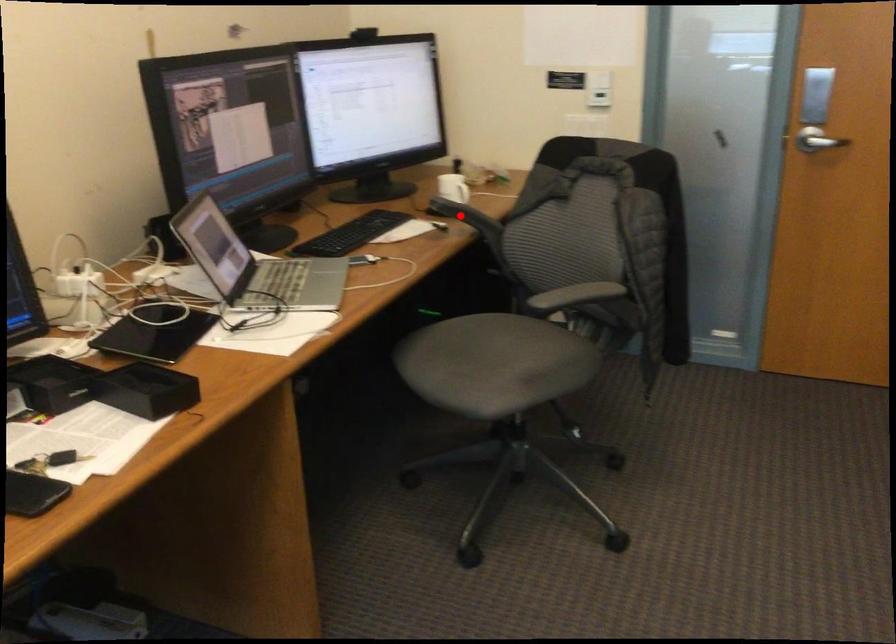
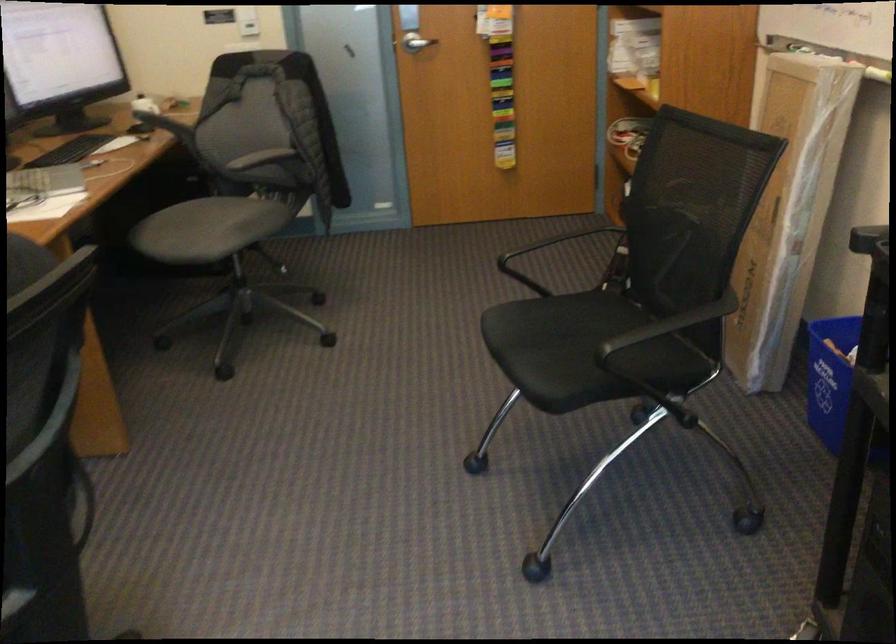
In the second image, find the point that corresponds to the highlighted location in the first image.

(158, 120)